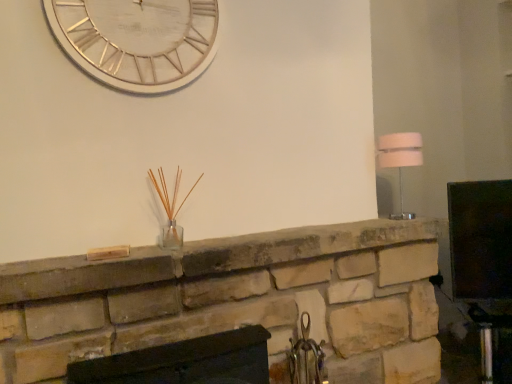
Question: In terms of width, does white metallic clock at upper center look wider or thinner when compared to white fabric lampshade at right?

Choices:
 (A) thin
 (B) wide

Answer: (A)

Question: From a real-world perspective, is white metallic clock at upper center above or below white fabric lampshade at right?

Choices:
 (A) above
 (B) below

Answer: (A)

Question: Which of these objects is positioned farthest from the white metallic clock at upper center?

Choices:
 (A) matte black fireplace at center, positioned as the 1th fireplace in bottom-to-top order
 (B) natural stone fireplace at center, which is the 2th fireplace in bottom-to-top order
 (C) white fabric lampshade at right

Answer: (C)

Question: Estimate the real-world distances between objects in this image. Which object is closer to the natural stone fireplace at center, which is the 2th fireplace in bottom-to-top order?

Choices:
 (A) matte black fireplace at center, positioned as the 1th fireplace in bottom-to-top order
 (B) white fabric lampshade at right
 (C) white metallic clock at upper center

Answer: (A)